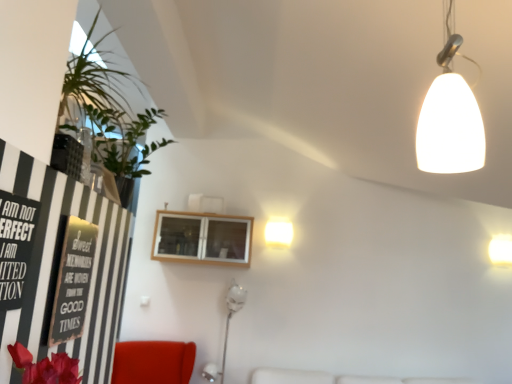
Question: In the image, is white glossy wall sconce at upper right, marked as the 2th lamp in a back-to-front arrangement, positioned in front of or behind white glossy wall lamp at upper center, which ranks as the 1th lamp in left-to-right order?

Choices:
 (A) behind
 (B) front

Answer: (B)

Question: From the image's perspective, is white glossy wall sconce at upper right, acting as the first lamp starting from the right, located above or below white glossy wall lamp at upper center, placed as the third lamp when sorted from right to left?

Choices:
 (A) above
 (B) below

Answer: (B)

Question: Estimate the real-world distances between objects in this image. Which object is farther from the wooden cabinet at upper center?

Choices:
 (A) black paper poster at left
 (B) white glossy lamp at lower center
 (C) white glossy lampshade at upper right, the 1th lamp when ordered from top to bottom
 (D) white glossy wall sconce at upper right, the 2th lamp when ordered from front to back
 (E) black matte signboard at left

Answer: (C)

Question: Based on their relative distances, which object is nearer to the white glossy wall sconce at upper right, the 3th lamp positioned from the left?

Choices:
 (A) black matte signboard at left
 (B) black paper poster at left
 (C) white glossy wall lamp at upper center, which is the second lamp in top-to-bottom order
 (D) green leafy plant at upper left
 (E) white glossy lamp at lower center

Answer: (C)